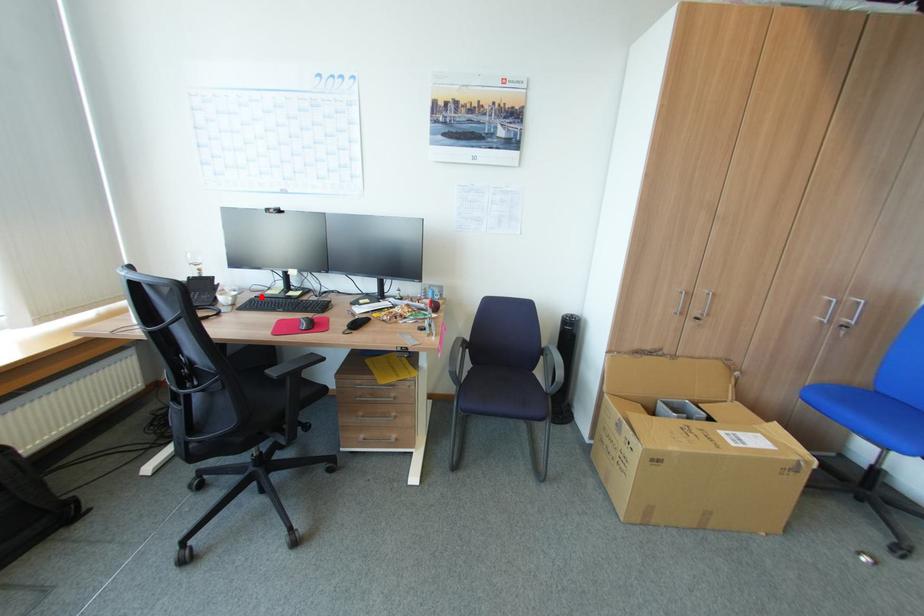
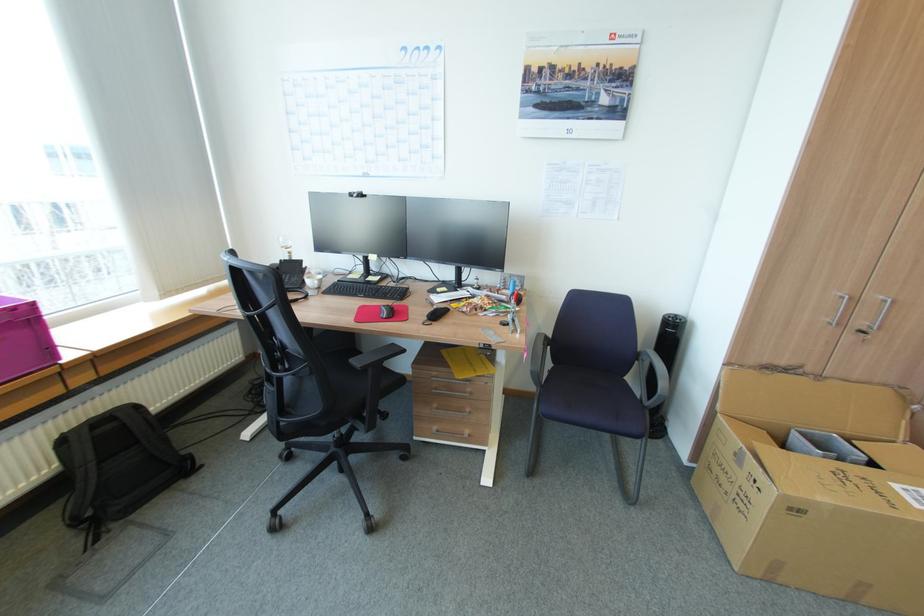
Where in the second image is the point corresponding to the highlighted location from the first image?

(344, 281)